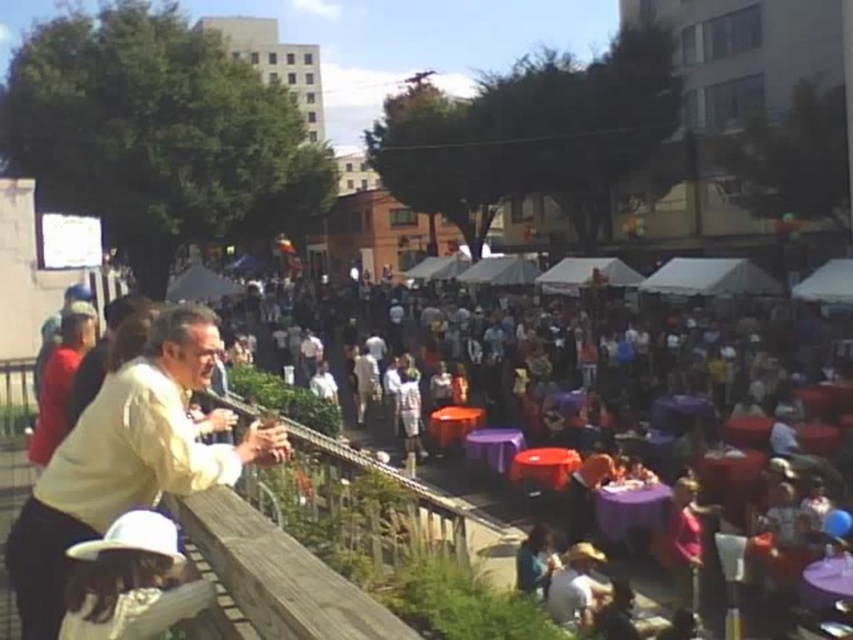
Question: Is purple fabric tables at center above white matte hat at lower left?

Choices:
 (A) yes
 (B) no

Answer: (B)

Question: Does purple fabric tables at center appear over white matte hat at lower left?

Choices:
 (A) yes
 (B) no

Answer: (B)

Question: Which of the following is the farthest from the observer?

Choices:
 (A) (608, 531)
 (B) (138, 596)

Answer: (A)

Question: Which point is farther from the camera taking this photo?

Choices:
 (A) (671, 545)
 (B) (85, 612)

Answer: (A)

Question: Which point appears farthest from the camera in this image?

Choices:
 (A) (621, 362)
 (B) (79, 624)

Answer: (A)

Question: Can you confirm if purple fabric tables at center is bigger than white matte hat at lower left?

Choices:
 (A) yes
 (B) no

Answer: (A)